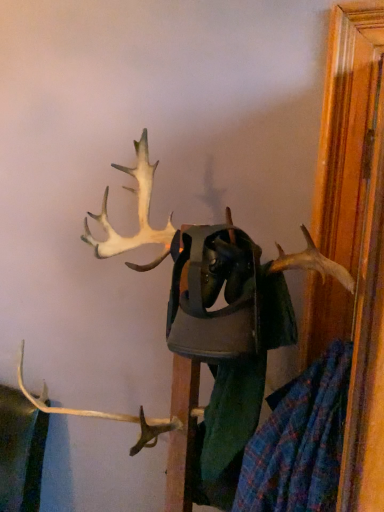
Question: Is plaid fabric shirt at center next to white matte antlers at upper center and touching it?

Choices:
 (A) no
 (B) yes

Answer: (B)

Question: Does plaid fabric shirt at center have a lesser width compared to white matte antlers at upper center?

Choices:
 (A) yes
 (B) no

Answer: (A)

Question: Considering the relative positions of plaid fabric shirt at center and white matte antlers at upper center in the image provided, is plaid fabric shirt at center behind white matte antlers at upper center?

Choices:
 (A) no
 (B) yes

Answer: (B)

Question: Can you confirm if plaid fabric shirt at center is smaller than white matte antlers at upper center?

Choices:
 (A) yes
 (B) no

Answer: (A)

Question: Is plaid fabric shirt at center turned away from white matte antlers at upper center?

Choices:
 (A) no
 (B) yes

Answer: (B)

Question: From a real-world perspective, is plaid fabric shirt at center located higher than white matte antlers at upper center?

Choices:
 (A) no
 (B) yes

Answer: (A)

Question: Does white matte antlers at upper center have a lesser width compared to plaid fabric shirt at center?

Choices:
 (A) no
 (B) yes

Answer: (A)

Question: Does white matte antlers at upper center lie in front of plaid fabric shirt at center?

Choices:
 (A) yes
 (B) no

Answer: (A)

Question: Is plaid fabric shirt at center located within white matte antlers at upper center?

Choices:
 (A) no
 (B) yes

Answer: (B)

Question: Would you say white matte antlers at upper center is a long distance from plaid fabric shirt at center?

Choices:
 (A) no
 (B) yes

Answer: (A)

Question: Can you confirm if white matte antlers at upper center is smaller than plaid fabric shirt at center?

Choices:
 (A) no
 (B) yes

Answer: (A)

Question: Can you confirm if white matte antlers at upper center is positioned to the left of plaid fabric shirt at center?

Choices:
 (A) yes
 (B) no

Answer: (A)

Question: From the image's perspective, is white matte antlers at upper center above or below plaid fabric shirt at center?

Choices:
 (A) below
 (B) above

Answer: (B)